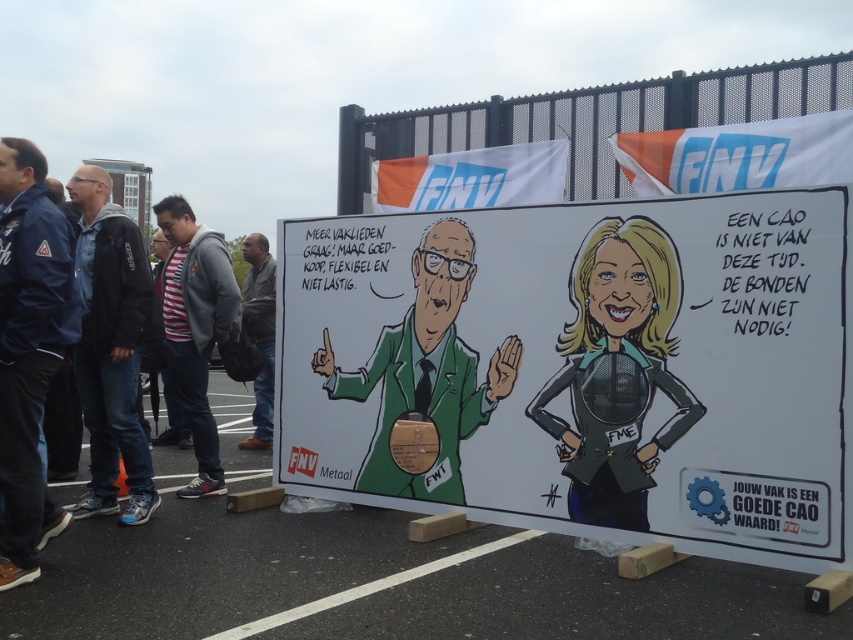
Question: Which object is the closest to the blue fabric jacket at left?

Choices:
 (A) white paper signboard at center
 (B) metallic green suit at center

Answer: (A)

Question: Can you confirm if green matte suit at center is thinner than blue fabric jacket at left?

Choices:
 (A) yes
 (B) no

Answer: (B)

Question: Considering the relative positions of white paper signboard at center and black jacket at left in the image provided, where is white paper signboard at center located with respect to black jacket at left?

Choices:
 (A) above
 (B) below

Answer: (B)

Question: Which of the following is the closest to the observer?

Choices:
 (A) (251, 260)
 (B) (135, 324)

Answer: (B)

Question: Which of these objects is positioned farthest from the black jacket at left?

Choices:
 (A) green matte suit at center
 (B) gray fleece jacket at left

Answer: (A)

Question: Does white paper poster at center have a larger size compared to black jacket at left?

Choices:
 (A) no
 (B) yes

Answer: (B)